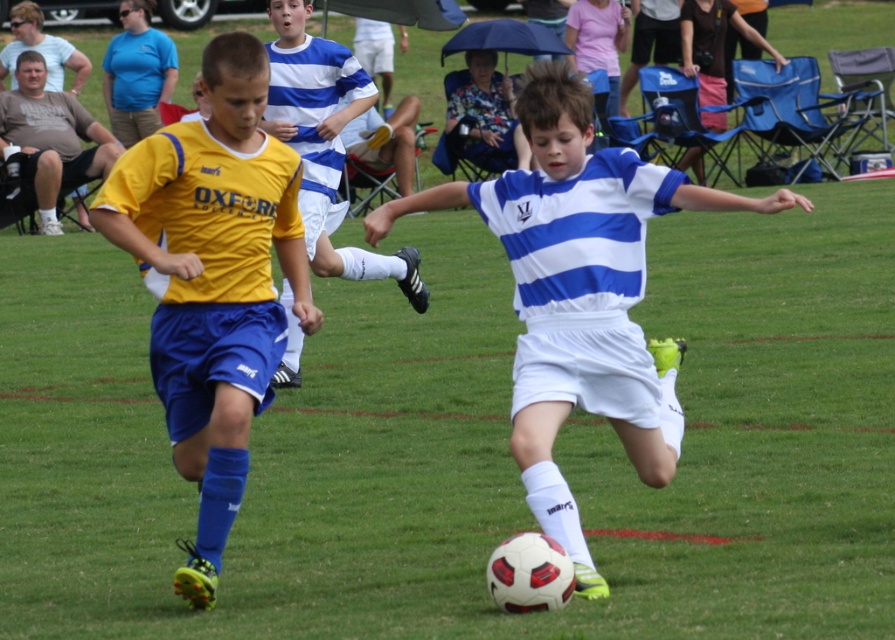
Question: Which point is farther to the camera?

Choices:
 (A) (309, 147)
 (B) (578, 284)
 (C) (202, 134)

Answer: (A)

Question: Can you confirm if white matte soccer ball at center is positioned above blue striped jersey at center?

Choices:
 (A) yes
 (B) no

Answer: (B)

Question: Is white matte soccer ball at center positioned at the back of yellow matte jersey at left?

Choices:
 (A) no
 (B) yes

Answer: (A)

Question: Is white matte soccer ball at center below blue striped jersey at center?

Choices:
 (A) no
 (B) yes

Answer: (B)

Question: Estimate the real-world distances between objects in this image. Which object is farther from the yellow matte jersey at left?

Choices:
 (A) blue striped jersey at center
 (B) white matte soccer ball at center

Answer: (A)

Question: Which point appears closest to the camera in this image?

Choices:
 (A) (237, 296)
 (B) (581, 592)
 (C) (300, 122)

Answer: (B)